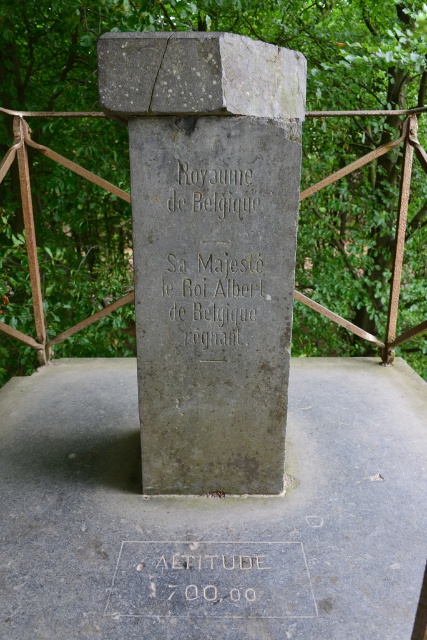
Who is shorter, gray concrete at center or etched stone altitude at center?

Standing shorter between the two is etched stone altitude at center.

Is gray concrete at center above etched stone altitude at center?

Yes.

Describe the element at coordinates (213, 515) in the screenshot. The height and width of the screenshot is (640, 427). I see `gray concrete at center` at that location.

Where is `gray concrete at center`? The height and width of the screenshot is (640, 427). gray concrete at center is located at coordinates (213, 515).

Can you confirm if gray concrete at center is positioned to the left of black stone engraving at center?

Indeed, gray concrete at center is positioned on the left side of black stone engraving at center.

Who is positioned more to the right, gray concrete at center or black stone engraving at center?

black stone engraving at center

Image resolution: width=427 pixels, height=640 pixels. I want to click on gray concrete at center, so click(x=213, y=515).

This screenshot has height=640, width=427. What are the coordinates of `gray concrete at center` in the screenshot? It's located at (213, 515).

Who is more distant from viewer, (125,99) or (204,595)?

The point (204,595) is behind.

Who is positioned more to the left, gray stone monument at center or etched stone altitude at center?

etched stone altitude at center is more to the left.

Identify the location of gray stone monument at center. Image resolution: width=427 pixels, height=640 pixels. pyautogui.click(x=210, y=248).